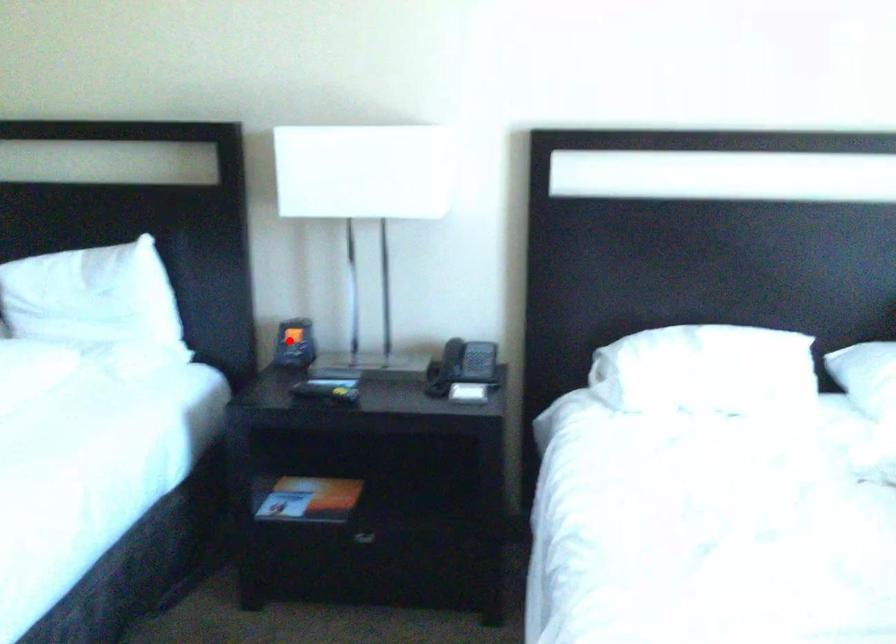
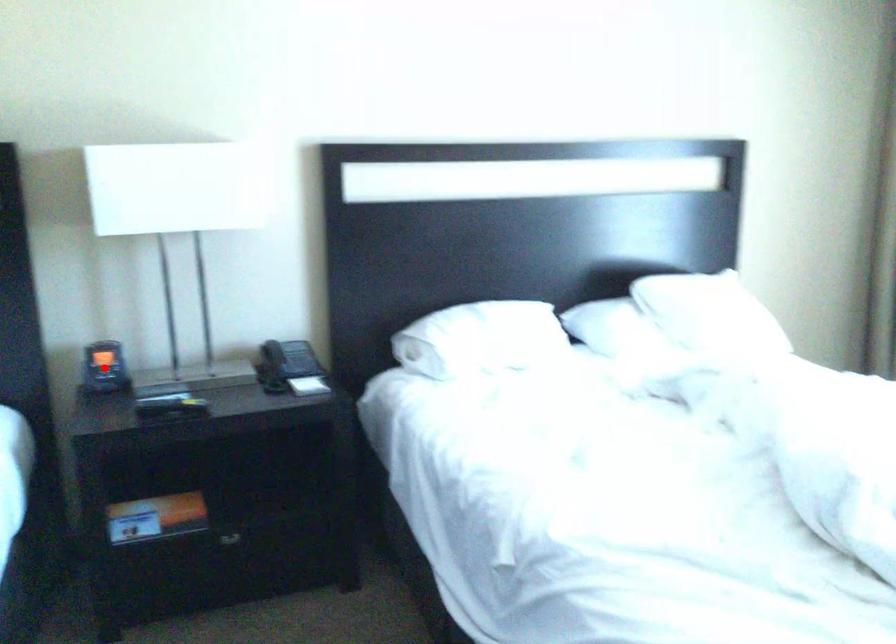
I am providing you with two images of the same scene from different viewpoints. A red point is marked on the first image and another point is marked on the second image. Does the point marked in image1 correspond to the same location as the one in image2?

Yes